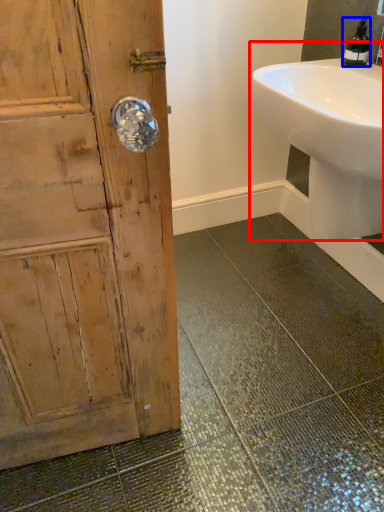
Question: Which of the following is the closest to the observer, sink (highlighted by a red box) or soap dispenser (highlighted by a blue box)?

Choices:
 (A) sink
 (B) soap dispenser

Answer: (A)